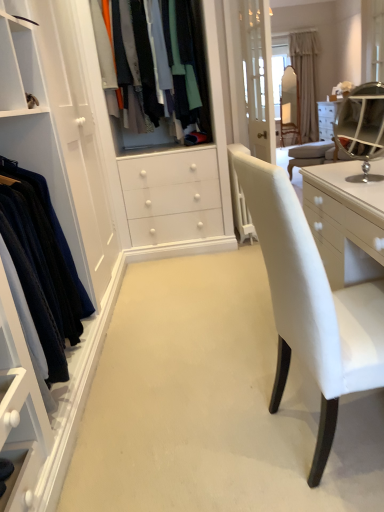
Question: From a real-world perspective, is velvet blue sweater at left, which ranks as the 1th clothing in bottom-to-top order, physically above matte fabric shirts at center, placed as the 2th clothing when sorted from front to back?

Choices:
 (A) yes
 (B) no

Answer: (B)

Question: Is velvet blue sweater at left, marked as the first clothing in a front-to-back arrangement, thinner than matte fabric shirts at center, which appears as the 1th clothing when viewed from the back?

Choices:
 (A) no
 (B) yes

Answer: (B)

Question: Considering the relative sizes of velvet blue sweater at left, the second clothing positioned from the top, and matte fabric shirts at center, placed as the 2th clothing when sorted from front to back, in the image provided, is velvet blue sweater at left, the second clothing positioned from the top, taller than matte fabric shirts at center, placed as the 2th clothing when sorted from front to back,?

Choices:
 (A) yes
 (B) no

Answer: (B)

Question: Does velvet blue sweater at left, marked as the first clothing in a front-to-back arrangement, have a larger size compared to matte fabric shirts at center, arranged as the 1th clothing when viewed from the top?

Choices:
 (A) yes
 (B) no

Answer: (B)

Question: Would you say velvet blue sweater at left, marked as the first clothing in a front-to-back arrangement, is a long distance from matte fabric shirts at center, arranged as the 1th clothing when viewed from the top?

Choices:
 (A) yes
 (B) no

Answer: (A)

Question: Is velvet blue sweater at left, the second clothing positioned from the top, wider or thinner than matte fabric shirts at center, placed as the 2th clothing when sorted from front to back?

Choices:
 (A) thin
 (B) wide

Answer: (A)

Question: Is velvet blue sweater at left, marked as the first clothing in a front-to-back arrangement, situated inside matte fabric shirts at center, arranged as the 1th clothing when viewed from the top, or outside?

Choices:
 (A) inside
 (B) outside

Answer: (B)

Question: From a real-world perspective, is velvet blue sweater at left, marked as the first clothing in a front-to-back arrangement, positioned above or below matte fabric shirts at center, arranged as the 1th clothing when viewed from the top?

Choices:
 (A) below
 (B) above

Answer: (A)

Question: From the image's perspective, is velvet blue sweater at left, which ranks as the 1th clothing in bottom-to-top order, above or below matte fabric shirts at center, placed as the 2th clothing when sorted from front to back?

Choices:
 (A) above
 (B) below

Answer: (B)

Question: From a real-world perspective, is matte fabric shirts at center, which appears as the 1th clothing when viewed from the back, above or below beige fabric curtain at upper center?

Choices:
 (A) above
 (B) below

Answer: (A)

Question: Is matte fabric shirts at center, placed as the 2th clothing when sorted from front to back, to the left or to the right of beige fabric curtain at upper center in the image?

Choices:
 (A) left
 (B) right

Answer: (A)

Question: In terms of width, does matte fabric shirts at center, arranged as the 1th clothing when viewed from the top, look wider or thinner when compared to beige fabric curtain at upper center?

Choices:
 (A) thin
 (B) wide

Answer: (B)

Question: Considering the positions of matte fabric shirts at center, which appears as the 1th clothing when viewed from the back, and beige fabric curtain at upper center in the image, is matte fabric shirts at center, which appears as the 1th clothing when viewed from the back, bigger or smaller than beige fabric curtain at upper center?

Choices:
 (A) big
 (B) small

Answer: (B)

Question: In terms of width, does silver/metallic vanity mirror at upper right look wider or thinner when compared to beige fabric curtain at upper center?

Choices:
 (A) wide
 (B) thin

Answer: (B)

Question: Is silver/metallic vanity mirror at upper right inside the boundaries of beige fabric curtain at upper center, or outside?

Choices:
 (A) inside
 (B) outside

Answer: (B)